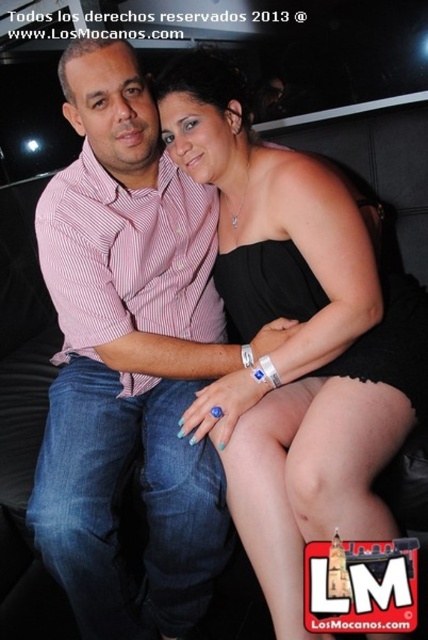
Question: Is pink striped shirt at center above black satin dress at center?

Choices:
 (A) yes
 (B) no

Answer: (B)

Question: Which of the following is the closest to the observer?

Choices:
 (A) black satin dress at center
 (B) pink striped shirt at center

Answer: (A)

Question: Does pink striped shirt at center have a larger size compared to black satin dress at center?

Choices:
 (A) yes
 (B) no

Answer: (A)

Question: Does pink striped shirt at center appear on the right side of black satin dress at center?

Choices:
 (A) no
 (B) yes

Answer: (A)